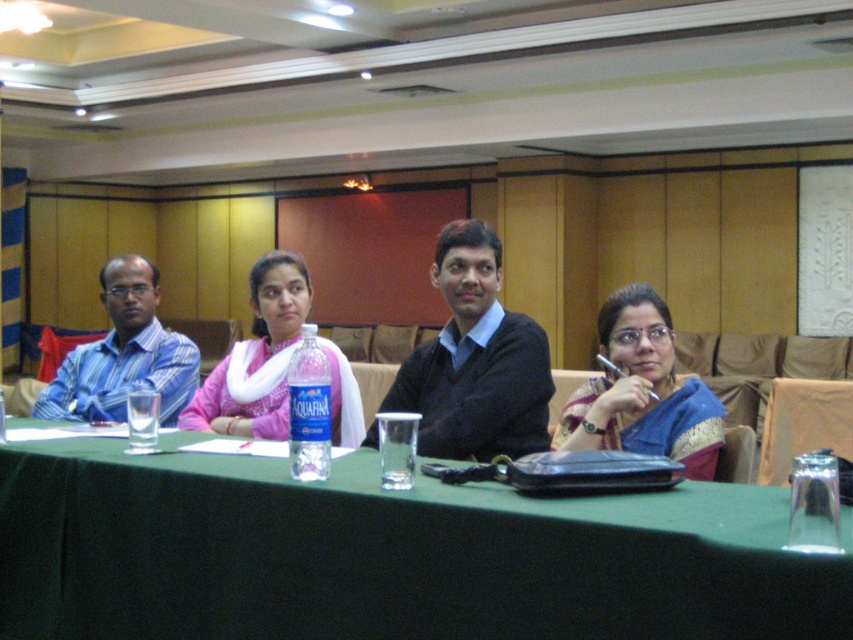
Question: Does blue silk saree at center appear on the right side of blue striped shirt at left?

Choices:
 (A) no
 (B) yes

Answer: (B)

Question: Can you confirm if black sweater at center is wider than blue silk saree at center?

Choices:
 (A) no
 (B) yes

Answer: (B)

Question: Is black sweater at center smaller than blue silk saree at center?

Choices:
 (A) yes
 (B) no

Answer: (B)

Question: Which of these objects is positioned closest to the blue silk saree at center?

Choices:
 (A) pink fabric scarf at center
 (B) black sweater at center

Answer: (B)

Question: Which point is farther to the camera?

Choices:
 (A) (103, 340)
 (B) (532, 404)
 (C) (672, 342)

Answer: (A)

Question: Based on their relative distances, which object is nearer to the blue silk saree at center?

Choices:
 (A) black sweater at center
 (B) pink fabric scarf at center
 (C) green fabric table at center
 (D) blue striped shirt at left

Answer: (A)